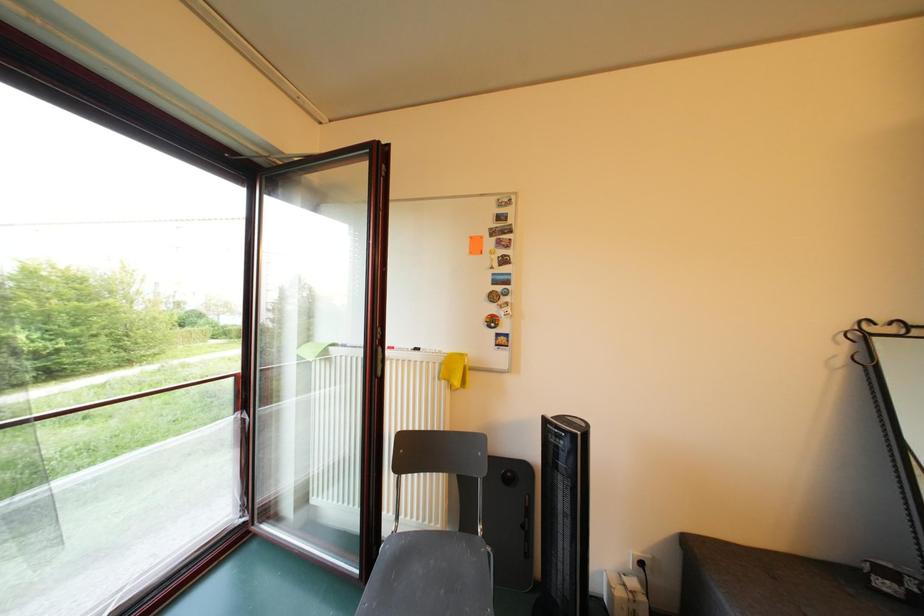
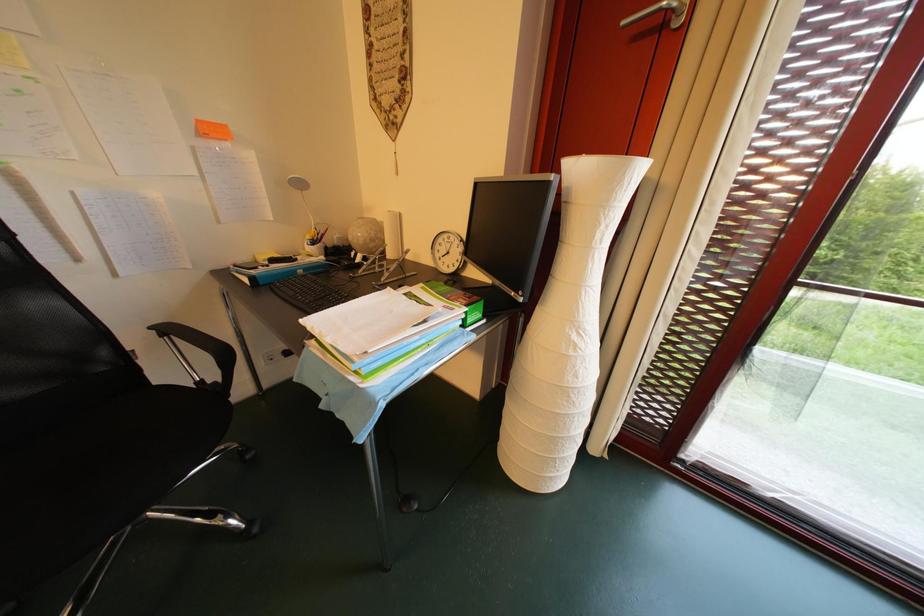
How did the camera likely rotate?

The camera's rotation is toward left-down.